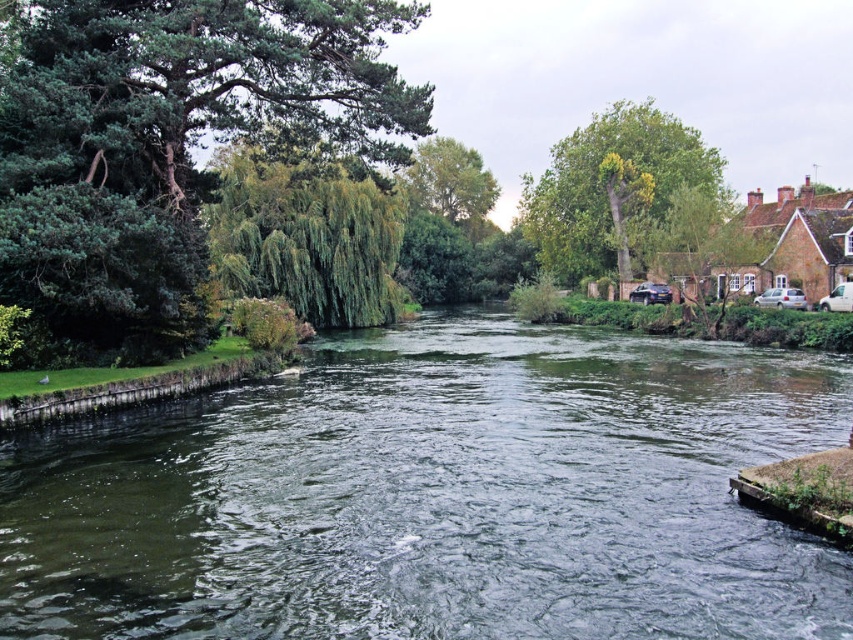
Question: From the image, what is the correct spatial relationship of green leafy tree at upper right in relation to green leafy tree at upper center?

Choices:
 (A) left
 (B) right

Answer: (B)

Question: Does green water at center have a greater width compared to green leafy tree at upper center?

Choices:
 (A) yes
 (B) no

Answer: (A)

Question: Is green water at center further to the viewer compared to green needle-like leaves at left?

Choices:
 (A) yes
 (B) no

Answer: (B)

Question: Among these objects, which one is farthest from the camera?

Choices:
 (A) green leafy tree at upper right
 (B) green needle-like leaves at left
 (C) green leafy tree at left

Answer: (A)

Question: Which of the following is the closest to the observer?

Choices:
 (A) (613, 221)
 (B) (419, 186)
 (C) (25, 493)

Answer: (C)

Question: Estimate the real-world distances between objects in this image. Which object is farther from the green leafy tree at upper center?

Choices:
 (A) green needle-like leaves at left
 (B) green leafy tree at left

Answer: (A)